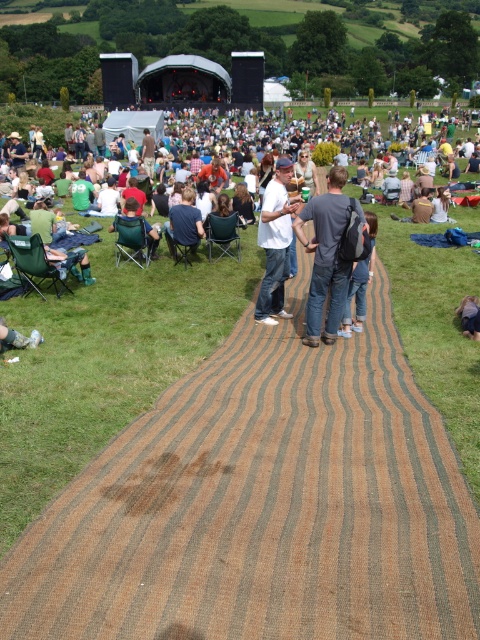
You are an attendee at the festival and want to move from your current position to the brown striped carpet at center. There is a dark blue shirt at center blocking your path. Can you walk around them without getting too close?

The brown striped carpet at center and dark blue shirt at center are 3.67 meters apart. Since the distance between them is more than enough to walk around safely, you can easily navigate around the dark blue shirt at center to reach the brown striped carpet at center without getting too close.

You are standing at the entrance of the festival and want to locate your friend who left their dark gray backpack at center. Where should you look relative to the striped pathway?

The dark gray backpack at center is located at the coordinates (326, 253), which is near the center of the image. Since the striped pathway is in the foreground, the backpack is positioned further back from the pathway on the grassy field.

You are attending a festival and want to sit down on the brown striped carpet at center. However, you notice someone wearing a dark blue shirt at center is already sitting there. Can you sit on the same carpet without moving them?

The brown striped carpet at center is positioned on the right side of dark blue shirt at center, meaning the person in the dark blue shirt is sitting to the left of the carpet. You can sit on the brown striped carpet at center as long as there is space available to your right side.